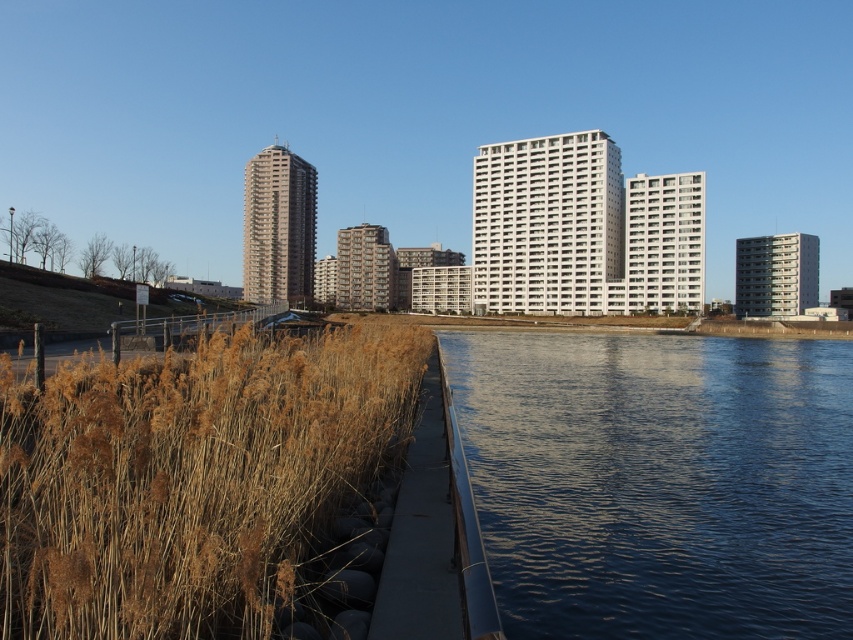
Can you confirm if blue smooth water at lower right is wider than dry grass at lower left?

Yes.

Is blue smooth water at lower right smaller than dry grass at lower left?

No.

The width and height of the screenshot is (853, 640). What do you see at coordinates (659, 481) in the screenshot?
I see `blue smooth water at lower right` at bounding box center [659, 481].

Image resolution: width=853 pixels, height=640 pixels. In order to click on blue smooth water at lower right in this screenshot , I will do `click(659, 481)`.